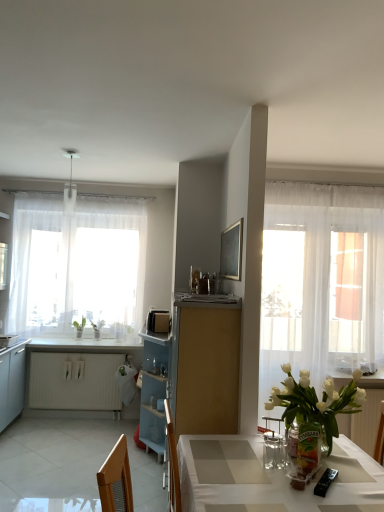
You are a GUI agent. You are given a task and a screenshot of the screen. Output one action in this format:
    pyautogui.click(x=<x>, y=<y>)
    Task: Click on the free space to the right of black plastic remote control at lower right, arranged as the 1th appliance when viewed from the front
    Image resolution: width=384 pixels, height=512 pixels.
    Given the screenshot: What is the action you would take?
    pyautogui.click(x=361, y=481)